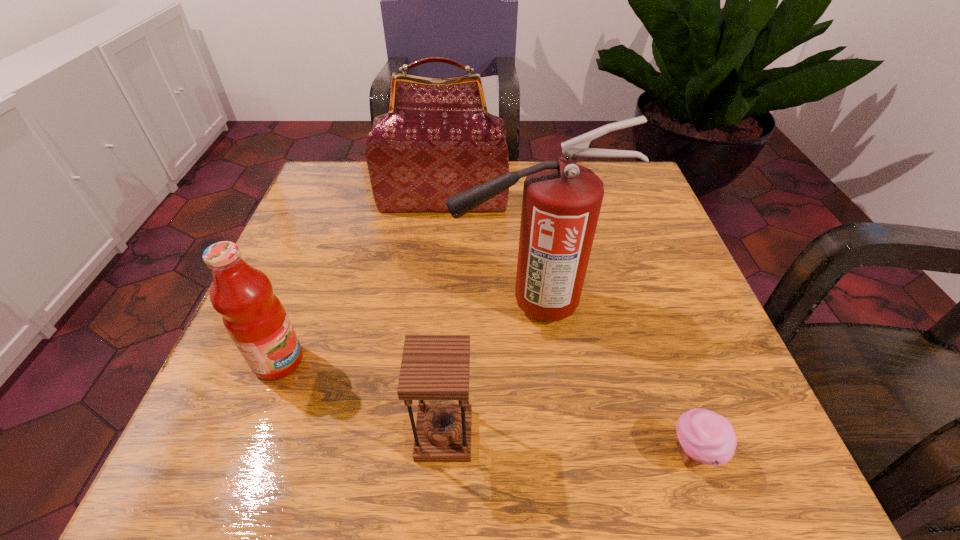
I want to click on vacant space that's between the shortest object and the fourth tallest object, so click(x=568, y=444).

The height and width of the screenshot is (540, 960). What are the coordinates of `unoccupied position between the handbag and the hourglass` in the screenshot? It's located at (444, 319).

Locate an element on the screen. The image size is (960, 540). free point between the fourth tallest object and the fourth nearest object is located at coordinates (487, 370).

Image resolution: width=960 pixels, height=540 pixels. I want to click on vacant area between the handbag and the leftmost object, so click(x=361, y=281).

Locate an element on the screen. This screenshot has height=540, width=960. free spot between the fire extinguisher and the shortest object is located at coordinates (611, 380).

I want to click on free space between the shortest object and the second shortest object, so pos(568,444).

Select which object is the fourth closest to the second shortest object. Please provide its 2D coordinates. Your answer should be formatted as a tuple, i.e. [(x, y)], where the tuple contains the x and y coordinates of a point satisfying the conditions above.

[(438, 140)]

Locate which object ranks second in proximity to the handbag. Please provide its 2D coordinates. Your answer should be formatted as a tuple, i.e. [(x, y)], where the tuple contains the x and y coordinates of a point satisfying the conditions above.

[(254, 317)]

Find the location of a particular element. free region that satisfies the following two spatial constraints: 1. on the front label of the second shortest object; 2. on the right side of the third nearest object is located at coordinates (251, 435).

At what (x,y) coordinates should I click in order to perform the action: click on vacant space that satisfies the following two spatial constraints: 1. on the front-facing side of the handbag; 2. on the left side of the hourglass. Please return your answer as a coordinate pair (x, y). This screenshot has height=540, width=960. Looking at the image, I should click on (420, 435).